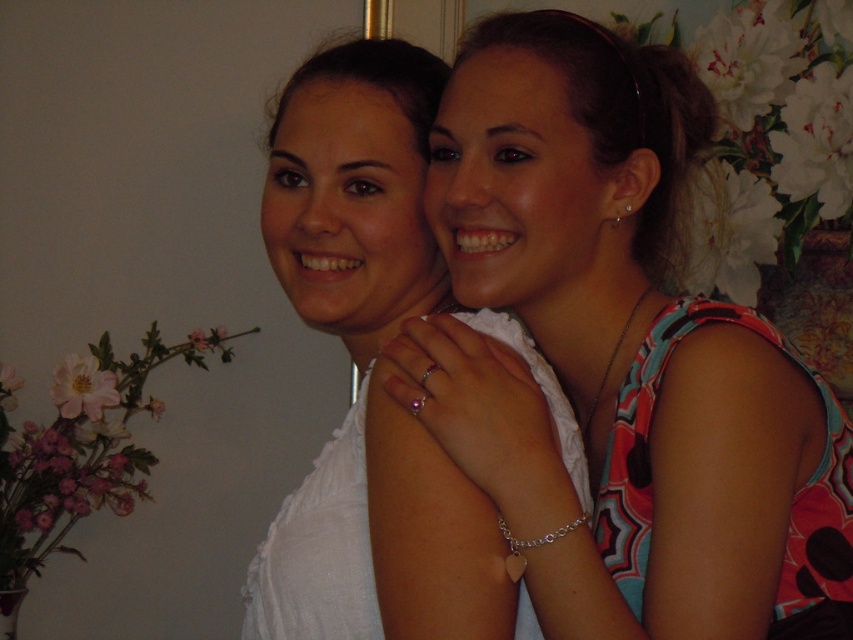
You are taking a photo of two people in a room. You want to focus on the person at point (827, 392) and the person at point (376, 636). Which point is closer to the camera?

Point (827, 392) is closer to the camera than point (376, 636).

You are a photographer setting up a photoshoot. You have two dresses to feature in the image, the multicolored fabric dress at center and the white fabric dress at center. Based on the scene description, which dress is positioned higher in the frame?

The multicolored fabric dress at center is located above the white fabric dress at center, so it is positioned higher in the frame.